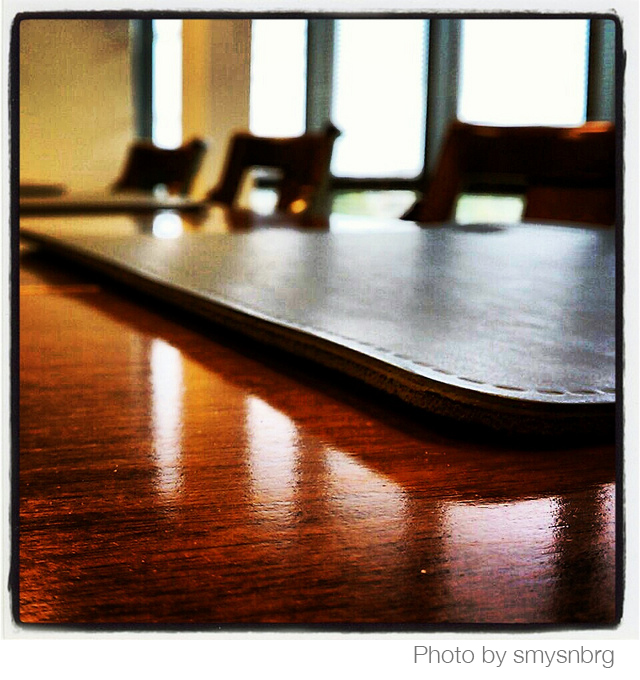
You are a GUI agent. You are given a task and a screenshot of the screen. Output one action in this format:
    pyautogui.click(x=<x>, y=<y>)
    Task: Click on the support column
    The width and height of the screenshot is (640, 680).
    Given the screenshot: What is the action you would take?
    pyautogui.click(x=203, y=84)